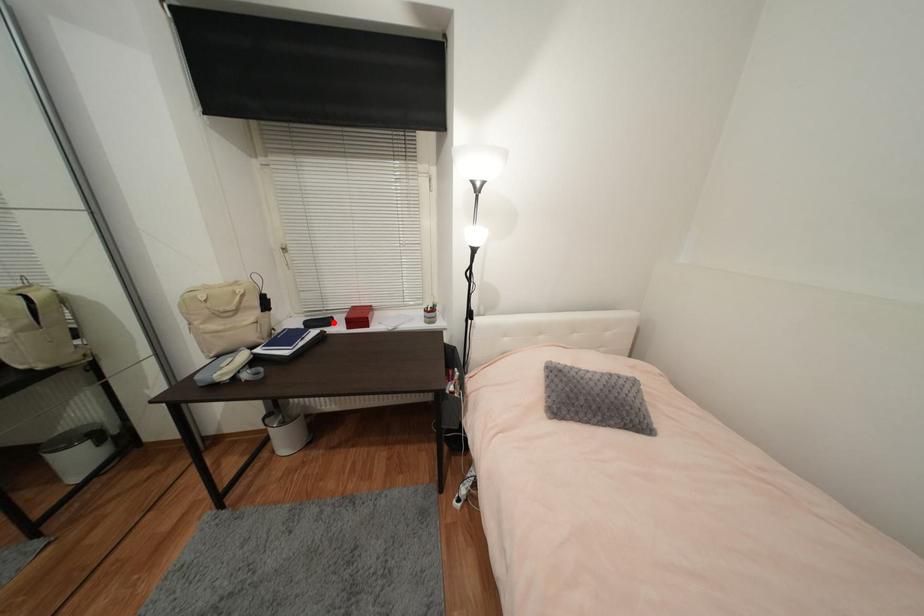
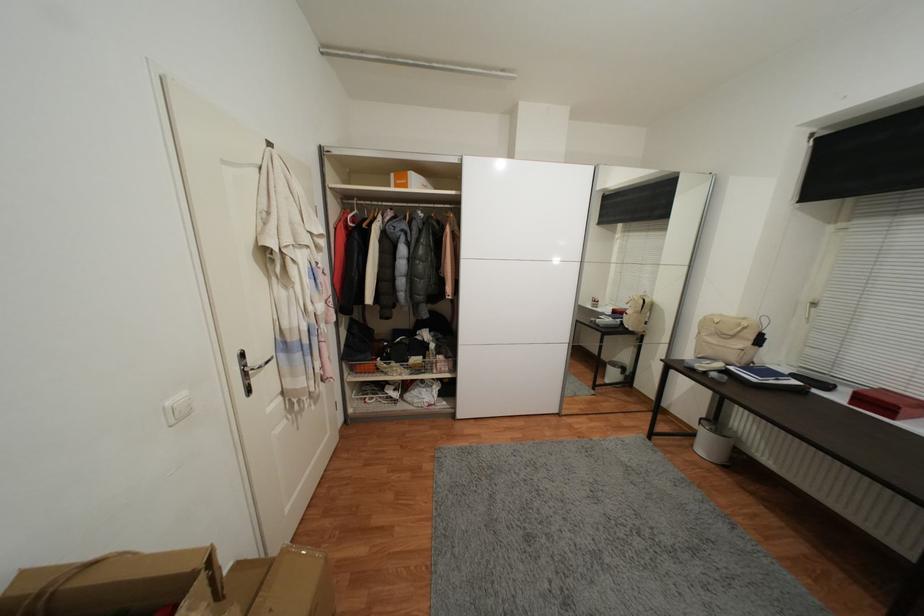
Locate, in the second image, the point that corresponds to the highlighted location in the first image.

(831, 387)